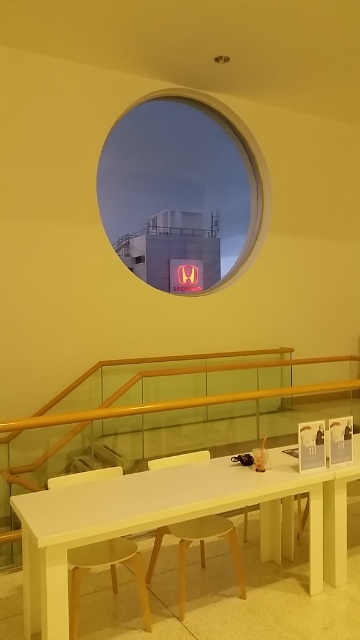
You are a photographer setting up a shot in this room. You need to position your camera so it can capture both the red neon sign at center and the white matte table at lower center in the frame. Based on their positions, which object should be placed closer to the camera to ensure both are in focus?

The white matte table at lower center should be placed closer to the camera because it is located below the red neon sign at center, meaning it is physically nearer to the camera position. This ensures both objects remain in focus within the depth of field.

You are standing in the room and want to take a photo of the Honda sign outside the circular window. The camera is on the white rectangular table. Can you reach the wooden polished rail at lower center to steady yourself while taking the photo?

The wooden polished rail at lower center is 3.53 meters away from you, so you cannot reach it to steady yourself while taking the photo.

You are a photographer standing at the entrance of the room. You need to place a tripod that requires 50 centimeters of space between the white matte table at lower center and wooden stool at center to set up a shot. Can you set up the tripod between them?

The white matte table at lower center is 44.49 centimeters from wooden stool at center, which is less than the required 50 centimeters. Therefore, the tripod cannot be set up between them due to insufficient space.